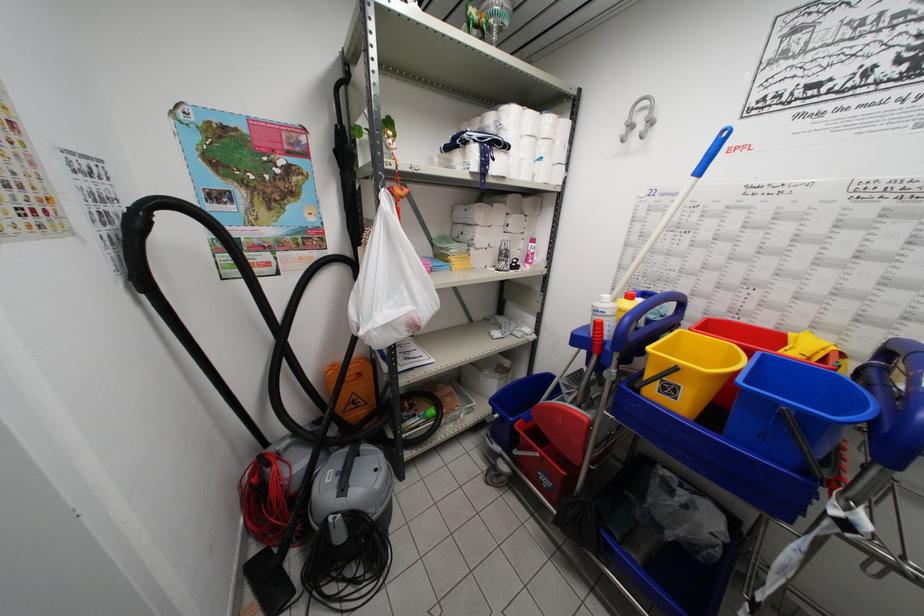
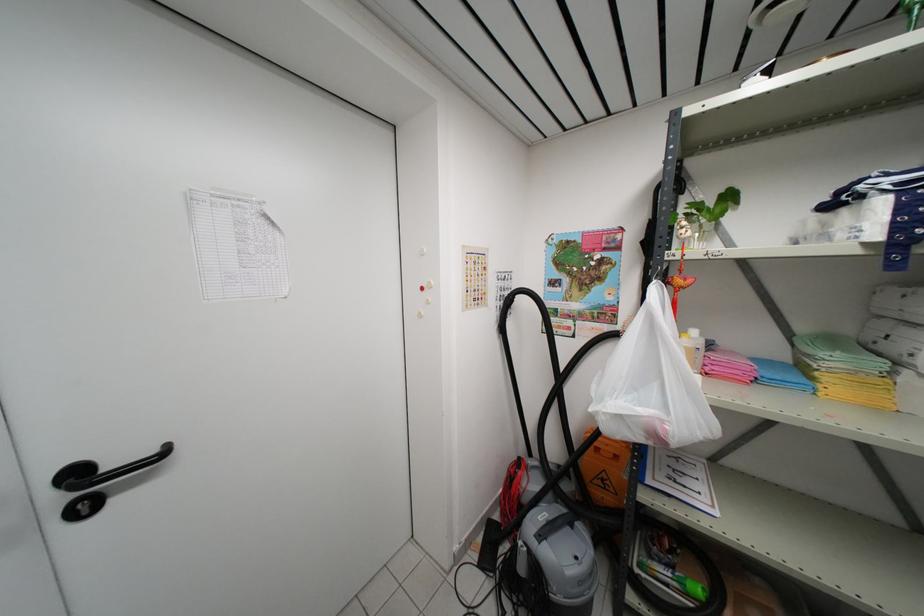
The point at (349, 455) is marked in the first image. Where is the corresponding point in the second image?

(566, 515)